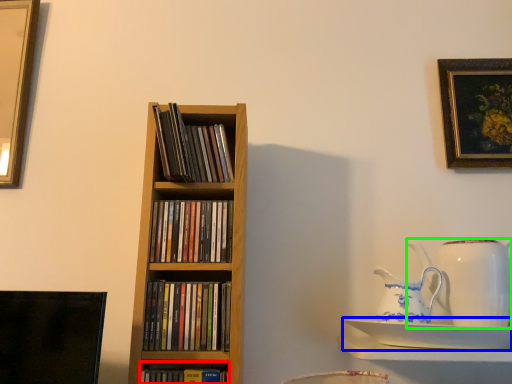
Question: Which object is the closest to the book (highlighted by a red box)? Choose among these: saucer (highlighted by a blue box) or jug (highlighted by a green box).

Choices:
 (A) saucer
 (B) jug

Answer: (A)